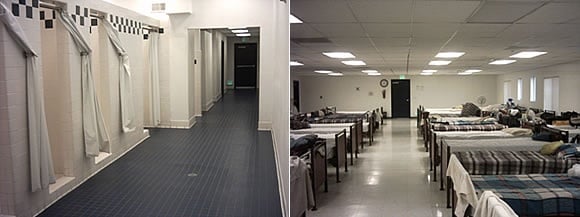
Where is `shower`? shower is located at coordinates (63, 126).